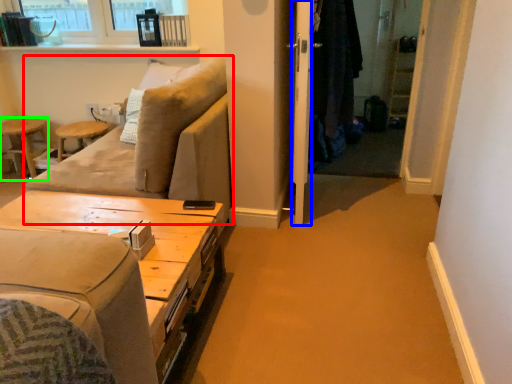
Question: Based on their relative distances, which object is nearer to studio couch (highlighted by a red box)? Choose from screen door (highlighted by a blue box) and bar stool (highlighted by a green box).

Choices:
 (A) screen door
 (B) bar stool

Answer: (A)